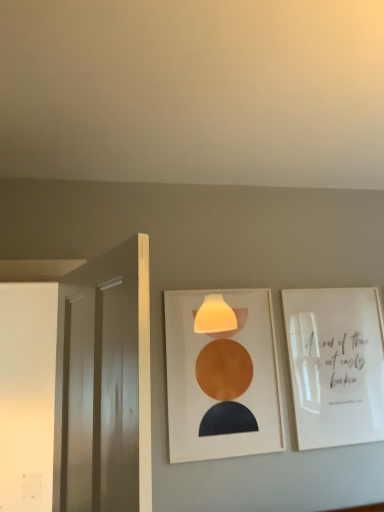
Locate an element on the screen. This screenshot has height=512, width=384. white glossy door at left is located at coordinates (104, 384).

How much space does matte white picture frame at center, acting as the first picture frame starting from the left, occupy vertically?

matte white picture frame at center, acting as the first picture frame starting from the left, is 30.09 inches in height.

You are a GUI agent. You are given a task and a screenshot of the screen. Output one action in this format:
    pyautogui.click(x=<x>, y=<y>)
    Task: Click on the matte white picture frame at center, which appears as the second picture frame when viewed from the right
    The width and height of the screenshot is (384, 512).
    Given the screenshot: What is the action you would take?
    pyautogui.click(x=222, y=375)

What do you see at coordinates (336, 365) in the screenshot? I see `white glossy picture frame at upper right, which is counted as the 2th picture frame, starting from the left` at bounding box center [336, 365].

At what (x,y) coordinates should I click in order to perform the action: click on white glossy door at left. Please return your answer as a coordinate pair (x, y). The height and width of the screenshot is (512, 384). Looking at the image, I should click on (104, 384).

In the scene shown: Relative to matte white picture frame at center, which appears as the second picture frame when viewed from the right, is white glossy door at left in front or behind?

white glossy door at left is in front of matte white picture frame at center, which appears as the second picture frame when viewed from the right.

Is white glossy door at left surrounding matte white picture frame at center, acting as the first picture frame starting from the left?

No.

Is white glossy door at left far away from matte white picture frame at center, acting as the first picture frame starting from the left?

No, white glossy door at left is in close proximity to matte white picture frame at center, acting as the first picture frame starting from the left.

Considering the positions of objects matte white picture frame at center, acting as the first picture frame starting from the left, and white glossy picture frame at upper right, the 1th picture frame viewed from the right, in the image provided, who is more to the left, matte white picture frame at center, acting as the first picture frame starting from the left, or white glossy picture frame at upper right, the 1th picture frame viewed from the right,?

matte white picture frame at center, acting as the first picture frame starting from the left.

At what (x,y) coordinates should I click in order to perform the action: click on picture frame above the white glossy picture frame at upper right, which is counted as the 2th picture frame, starting from the left (from a real-world perspective). Please return your answer as a coordinate pair (x, y). The height and width of the screenshot is (512, 384). Looking at the image, I should click on (222, 375).

Which of these two, matte white picture frame at center, which appears as the second picture frame when viewed from the right, or white glossy picture frame at upper right, the 1th picture frame viewed from the right, is smaller?

matte white picture frame at center, which appears as the second picture frame when viewed from the right.

Based on the photo, how distant is matte white picture frame at center, which appears as the second picture frame when viewed from the right, from white glossy picture frame at upper right, the 1th picture frame viewed from the right?

They are 32.37 centimeters apart.

Measure the distance between white glossy door at left and white glossy picture frame at upper right, the 1th picture frame viewed from the right.

The distance of white glossy door at left from white glossy picture frame at upper right, the 1th picture frame viewed from the right, is 1.07 meters.

Considering the relative sizes of white glossy door at left and white glossy picture frame at upper right, which is counted as the 2th picture frame, starting from the left, in the image provided, is white glossy door at left shorter than white glossy picture frame at upper right, which is counted as the 2th picture frame, starting from the left,?

No, white glossy door at left is not shorter than white glossy picture frame at upper right, which is counted as the 2th picture frame, starting from the left.

Can white glossy picture frame at upper right, which is counted as the 2th picture frame, starting from the left, be found inside white glossy door at left?

No, white glossy picture frame at upper right, which is counted as the 2th picture frame, starting from the left, is not inside white glossy door at left.

Is white glossy door at left aimed at white glossy picture frame at upper right, the 1th picture frame viewed from the right?

No, white glossy door at left is not aimed at white glossy picture frame at upper right, the 1th picture frame viewed from the right.

Who is shorter, white glossy picture frame at upper right, the 1th picture frame viewed from the right, or white glossy door at left?

white glossy picture frame at upper right, the 1th picture frame viewed from the right.

Is white glossy door at left surrounded by white glossy picture frame at upper right, which is counted as the 2th picture frame, starting from the left?

No, white glossy door at left is located outside of white glossy picture frame at upper right, which is counted as the 2th picture frame, starting from the left.

Is point (322, 442) farther from viewer compared to point (81, 500)?

Yes, it is.

From the image's perspective, between white glossy picture frame at upper right, the 1th picture frame viewed from the right, and white glossy door at left, who is located below?

From the image's view, white glossy picture frame at upper right, the 1th picture frame viewed from the right, is below.

The width and height of the screenshot is (384, 512). I want to click on door below the matte white picture frame at center, which appears as the second picture frame when viewed from the right (from a real-world perspective), so click(104, 384).

Based on the photo, how far apart are matte white picture frame at center, acting as the first picture frame starting from the left, and white glossy door at left?

The distance of matte white picture frame at center, acting as the first picture frame starting from the left, from white glossy door at left is 22.94 inches.

Is matte white picture frame at center, acting as the first picture frame starting from the left, with white glossy door at left?

No, matte white picture frame at center, acting as the first picture frame starting from the left, is not beside white glossy door at left.

Does matte white picture frame at center, which appears as the second picture frame when viewed from the right, appear on the left side of white glossy door at left?

Incorrect, matte white picture frame at center, which appears as the second picture frame when viewed from the right, is not on the left side of white glossy door at left.

Looking at the image, does white glossy picture frame at upper right, the 1th picture frame viewed from the right, seem bigger or smaller compared to matte white picture frame at center, acting as the first picture frame starting from the left?

In the image, white glossy picture frame at upper right, the 1th picture frame viewed from the right, appears to be larger than matte white picture frame at center, acting as the first picture frame starting from the left.

Would you say white glossy picture frame at upper right, the 1th picture frame viewed from the right, is a long distance from matte white picture frame at center, acting as the first picture frame starting from the left?

They are positioned close to each other.

From the image's perspective, is white glossy picture frame at upper right, the 1th picture frame viewed from the right, located above or below matte white picture frame at center, acting as the first picture frame starting from the left?

Based on their image positions, white glossy picture frame at upper right, the 1th picture frame viewed from the right, is located beneath matte white picture frame at center, acting as the first picture frame starting from the left.

Which object is closer to the camera, white glossy picture frame at upper right, the 1th picture frame viewed from the right, or matte white picture frame at center, which appears as the second picture frame when viewed from the right?

Positioned in front is matte white picture frame at center, which appears as the second picture frame when viewed from the right.

Find the location of a particular element. door that appears below the matte white picture frame at center, acting as the first picture frame starting from the left (from a real-world perspective) is located at coordinates pos(104,384).

The width and height of the screenshot is (384, 512). In order to click on picture frame in front of the white glossy picture frame at upper right, which is counted as the 2th picture frame, starting from the left in this screenshot , I will do `click(222, 375)`.

From the image, which object appears to be nearer to white glossy door at left, matte white picture frame at center, which appears as the second picture frame when viewed from the right, or white glossy picture frame at upper right, which is counted as the 2th picture frame, starting from the left?

matte white picture frame at center, which appears as the second picture frame when viewed from the right, is closer to white glossy door at left.

Based on their spatial positions, is white glossy door at left or matte white picture frame at center, which appears as the second picture frame when viewed from the right, closer to white glossy picture frame at upper right, the 1th picture frame viewed from the right?

The object closer to white glossy picture frame at upper right, the 1th picture frame viewed from the right, is matte white picture frame at center, which appears as the second picture frame when viewed from the right.

From the image, which object appears to be farther from white glossy picture frame at upper right, which is counted as the 2th picture frame, starting from the left, matte white picture frame at center, which appears as the second picture frame when viewed from the right, or white glossy door at left?

white glossy door at left is further to white glossy picture frame at upper right, which is counted as the 2th picture frame, starting from the left.

Looking at this image, considering their positions, is white glossy door at left positioned closer to matte white picture frame at center, which appears as the second picture frame when viewed from the right, than white glossy picture frame at upper right, the 1th picture frame viewed from the right?

white glossy picture frame at upper right, the 1th picture frame viewed from the right, lies closer to matte white picture frame at center, which appears as the second picture frame when viewed from the right, than the other object.

Which object lies nearer to the anchor point white glossy door at left, white glossy picture frame at upper right, which is counted as the 2th picture frame, starting from the left, or matte white picture frame at center, acting as the first picture frame starting from the left?

matte white picture frame at center, acting as the first picture frame starting from the left, is positioned closer to the anchor white glossy door at left.

When comparing their distances from matte white picture frame at center, which appears as the second picture frame when viewed from the right, does white glossy picture frame at upper right, the 1th picture frame viewed from the right, or white glossy door at left seem closer?

white glossy picture frame at upper right, the 1th picture frame viewed from the right, is closer to matte white picture frame at center, which appears as the second picture frame when viewed from the right.

Image resolution: width=384 pixels, height=512 pixels. I want to click on picture frame between white glossy door at left and white glossy picture frame at upper right, the 1th picture frame viewed from the right, so click(x=222, y=375).